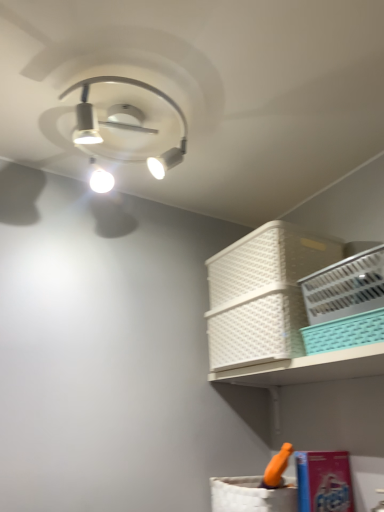
Question: From a real-world perspective, is white plastic basket at upper right, the third basket positioned from the front, under white plastic basket at upper right, positioned as the 4th basket in front-to-back order?

Choices:
 (A) no
 (B) yes

Answer: (B)

Question: Is white plastic basket at upper right, placed as the second basket when sorted from back to front, taller than white plastic basket at upper right, marked as the first basket in a back-to-front arrangement?

Choices:
 (A) no
 (B) yes

Answer: (B)

Question: Is white plastic basket at upper right, placed as the second basket when sorted from back to front, with white plastic basket at upper right, positioned as the 4th basket in front-to-back order?

Choices:
 (A) no
 (B) yes

Answer: (B)

Question: Is the position of white plastic basket at upper right, placed as the second basket when sorted from back to front, more distant than that of white plastic basket at upper right, positioned as the 4th basket in front-to-back order?

Choices:
 (A) no
 (B) yes

Answer: (A)

Question: Is white plastic basket at upper right, placed as the second basket when sorted from back to front, not close to white plastic basket at upper right, positioned as the 4th basket in front-to-back order?

Choices:
 (A) yes
 (B) no

Answer: (B)

Question: Is white plastic basket at upper right, the third basket positioned from the front, outside of white plastic basket at upper right, positioned as the 4th basket in front-to-back order?

Choices:
 (A) yes
 (B) no

Answer: (A)

Question: Is white plastic basket at upper right, the third basket positioned from the front, at the left side of teal plastic basket at upper right, the second basket in the front-to-back sequence?

Choices:
 (A) no
 (B) yes

Answer: (B)

Question: From a real-world perspective, is white plastic basket at upper right, placed as the second basket when sorted from back to front, positioned over teal plastic basket at upper right, which appears as the 3th basket when viewed from the back, based on gravity?

Choices:
 (A) no
 (B) yes

Answer: (B)

Question: Is white plastic basket at upper right, placed as the second basket when sorted from back to front, looking in the opposite direction of teal plastic basket at upper right, which appears as the 3th basket when viewed from the back?

Choices:
 (A) no
 (B) yes

Answer: (A)

Question: Is the position of white plastic basket at upper right, the third basket positioned from the front, less distant than that of teal plastic basket at upper right, the second basket in the front-to-back sequence?

Choices:
 (A) no
 (B) yes

Answer: (A)

Question: Does white plastic basket at upper right, the third basket positioned from the front, have a greater width compared to teal plastic basket at upper right, the second basket in the front-to-back sequence?

Choices:
 (A) yes
 (B) no

Answer: (A)

Question: Is white plastic basket at upper right, the third basket positioned from the front, taller than teal plastic basket at upper right, which appears as the 3th basket when viewed from the back?

Choices:
 (A) yes
 (B) no

Answer: (A)

Question: Is teal plastic basket at upper right, which appears as the 3th basket when viewed from the back, bigger than white plastic basket at upper right, acting as the fourth basket starting from the back?

Choices:
 (A) yes
 (B) no

Answer: (B)